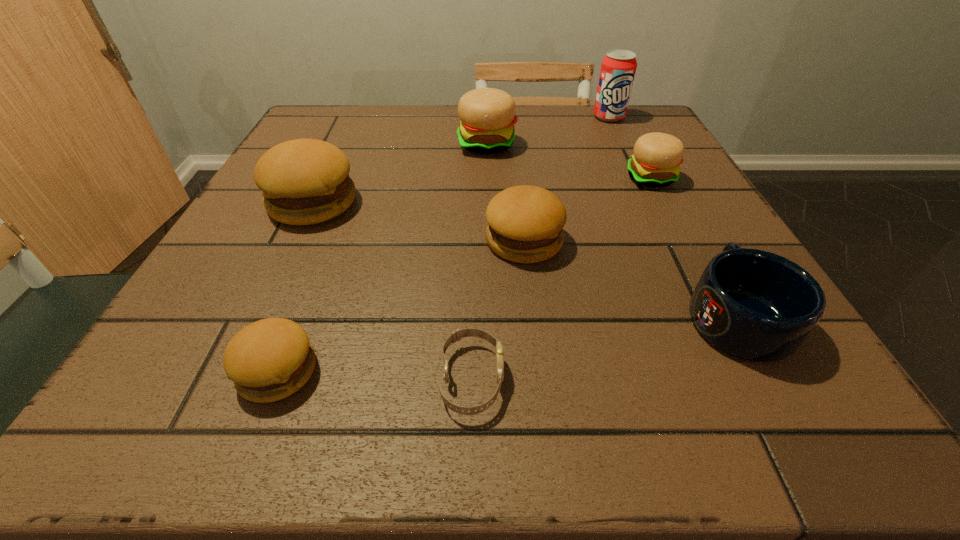
This screenshot has height=540, width=960. In order to click on object located at the near left corner in this screenshot , I will do `click(268, 360)`.

Locate an element on the screen. object that is at the far right corner is located at coordinates (618, 68).

In order to click on object that is at the near right corner in this screenshot , I will do click(755, 305).

Image resolution: width=960 pixels, height=540 pixels. What are the coordinates of `vacant space at the far edge` in the screenshot? It's located at (425, 113).

Where is `free point at the near edge`? This screenshot has height=540, width=960. free point at the near edge is located at coordinates (500, 429).

In the image, there is a desktop. Find the location of `free region at the left edge`. free region at the left edge is located at coordinates (204, 276).

In the image, there is a desktop. Where is `free region at the right edge`? free region at the right edge is located at coordinates (691, 214).

Identify the location of vacant area at the far left corner of the desktop. Image resolution: width=960 pixels, height=540 pixels. click(315, 125).

What are the coordinates of `blank space at the near left corner of the desktop` in the screenshot? It's located at (184, 386).

This screenshot has height=540, width=960. Identify the location of vacant region at the far right corner of the desktop. click(587, 115).